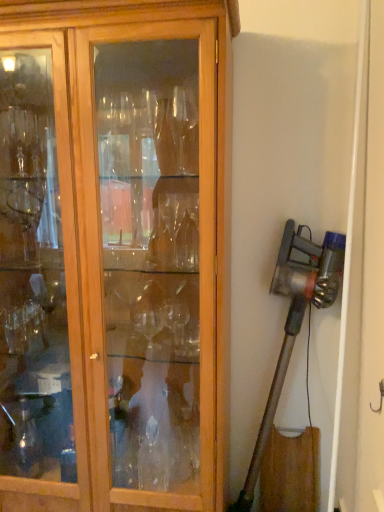
Describe the element at coordinates (112, 255) in the screenshot. I see `light wood cabinet at center` at that location.

At what (x,y) coordinates should I click in order to perform the action: click on light wood cabinet at center. Please return your answer as a coordinate pair (x, y). The width and height of the screenshot is (384, 512). Looking at the image, I should click on (112, 255).

Find the location of a particular element. light wood cabinet at center is located at coordinates (112, 255).